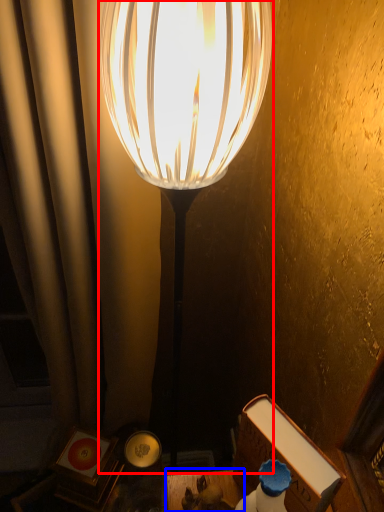
Question: Which of the following is the closest to the observer, lamp (highlighted by a red box) or table (highlighted by a blue box)?

Choices:
 (A) lamp
 (B) table

Answer: (A)